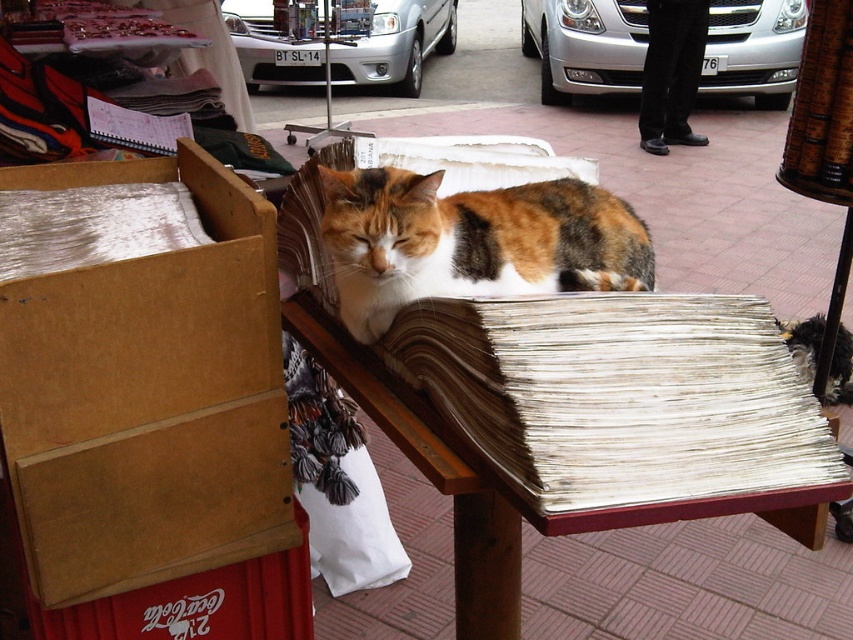
You are a delivery person who needs to place a new package on the table where the cat is resting. The package is 10 cm thick. The table has limited space between the brown cardboard box at left and the metallic silver car at center. Can the package fit between them?

The brown cardboard box at left is thinner than the metallic silver car at center. Since the package is 10 cm thick, it might fit between them if the space between the two objects is at least 10 cm. However, the exact distance isn

You are standing in front of a street scene with a calico cat resting on a stack of newspapers on a wooden table. There are items like a cardboard box, a red Coca Cola crate, and folded clothes nearby. You want to place a small potted plant exactly 1.5 meters away from your current position. Can you place it at point (157, 200)?

The distance between point (157, 200) and the viewer is 1.64 meters. Since you want to place the potted plant 1.5 meters away, the point is too far. Choose a closer spot.